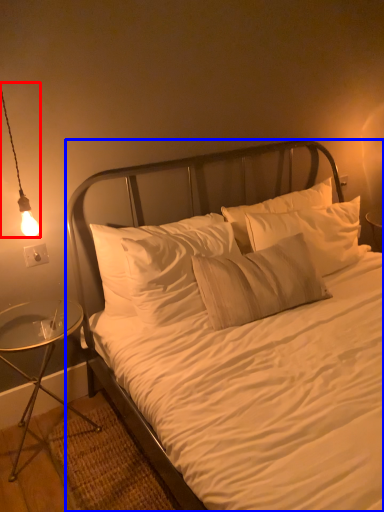
Question: Which point is closer to the camera, lamp (highlighted by a red box) or bed (highlighted by a blue box)?

Choices:
 (A) lamp
 (B) bed

Answer: (B)